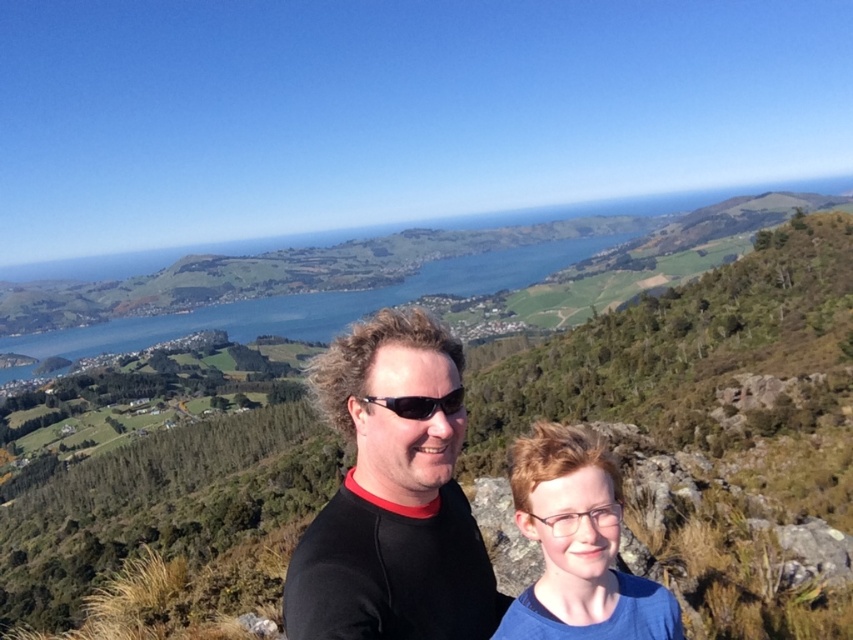
You are a photographer aiming to capture the two people in the scene. Since you want to ensure both the black matte shirt at center and the matte black shirt at center are clearly visible in your shot, which one should you focus on first if you want to start from the left side?

The black matte shirt at center is to the left of matte black shirt at center, so you should focus on the black matte shirt at center first since it is positioned further to the left.

You are standing at the point closer to the viewer between point (340, 563) and point (460, 387). If you want to walk towards the distant mountains in the background, which direction should you move relative to these two points?

You should move towards point (460, 387) because it is farther from the viewer, meaning it is closer to the distant mountains in the background.

Looking at this image, you are a photographer positioned at the center of the scene. You want to capture a photo that includes both the black matte shirt at center and the matte black shirt at center. Given that your camera has a maximum focus range of 10 feet, will you be able to focus on both subjects simultaneously?

The black matte shirt at center is 11.82 feet away from the matte black shirt at center. Since the distance between them exceeds the camera maximum focus range of 10 feet, you will not be able to focus on both subjects simultaneously.